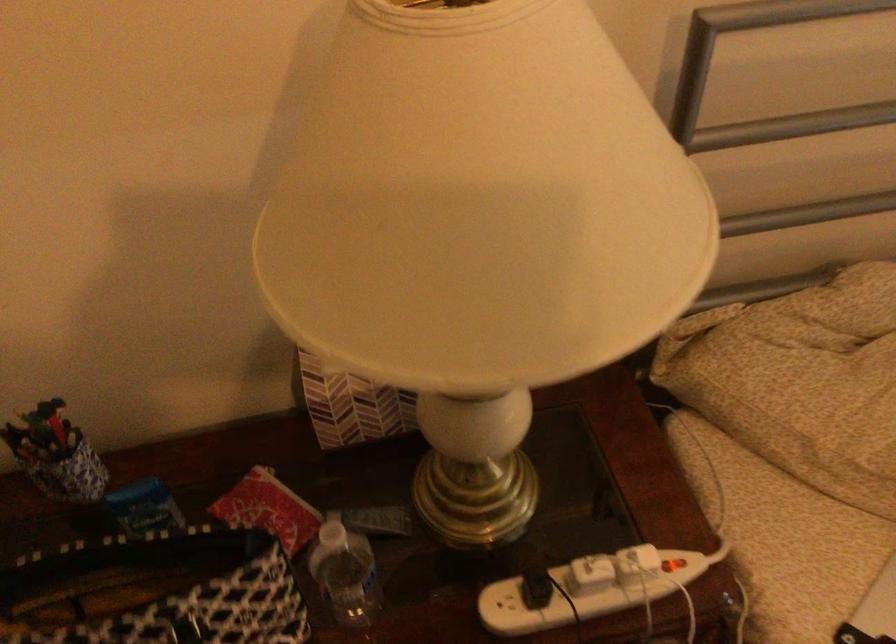
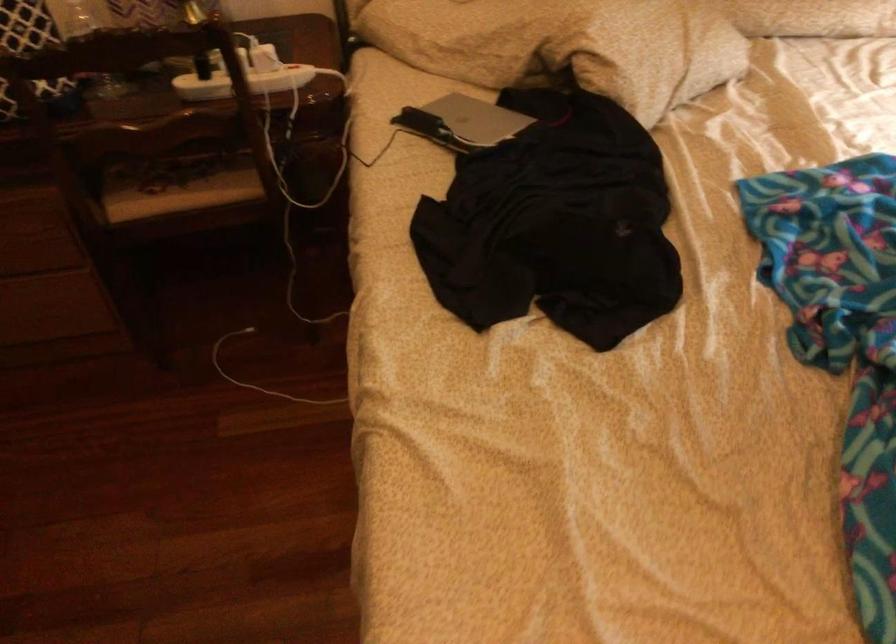
Which direction would the cameraman need to move to produce the second image?

The movement direction of the cameraman is right, backward.